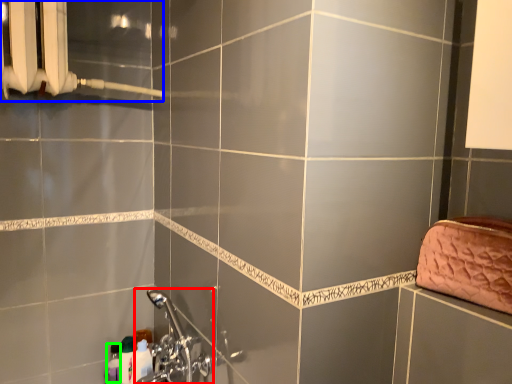
Question: Which is farther away from plumbing fixture (highlighted by a red box)? shower (highlighted by a blue box) or toiletry (highlighted by a green box)?

Choices:
 (A) shower
 (B) toiletry

Answer: (A)